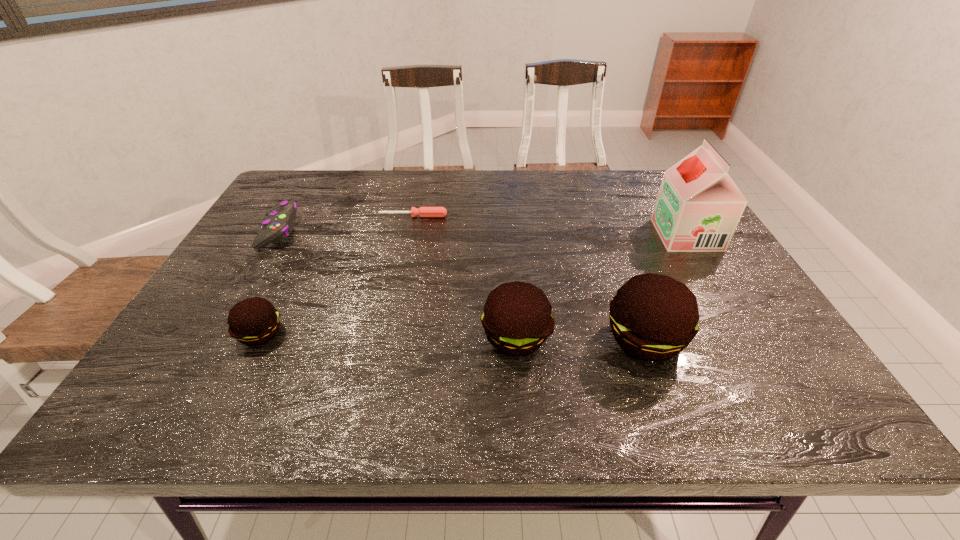
You are a GUI agent. You are given a task and a screenshot of the screen. Output one action in this format:
    pyautogui.click(x=<x>, y=<y>)
    Task: Click on the object positioned at the right edge
    Image resolution: width=960 pixels, height=540 pixels.
    Given the screenshot: What is the action you would take?
    pyautogui.click(x=698, y=208)

I want to click on object that is at the near left corner, so click(x=254, y=321).

Locate an element on the screen. Image resolution: width=960 pixels, height=540 pixels. vacant space at the far edge is located at coordinates (553, 176).

The width and height of the screenshot is (960, 540). In order to click on vacant space at the near edge of the desktop in this screenshot , I will do `click(614, 370)`.

Where is `free space at the left edge of the desktop`? free space at the left edge of the desktop is located at coordinates (207, 300).

In the image, there is a desktop. What are the coordinates of `free space at the right edge` in the screenshot? It's located at (673, 258).

You are a GUI agent. You are given a task and a screenshot of the screen. Output one action in this format:
    pyautogui.click(x=<x>, y=<y>)
    Task: Click on the free region at the far left corner of the desktop
    The image size is (960, 540).
    Given the screenshot: What is the action you would take?
    pyautogui.click(x=299, y=179)

At what (x,y) coordinates should I click in order to perform the action: click on free space at the far right corner. Please return your answer as a coordinate pair (x, y). The width and height of the screenshot is (960, 540). Looking at the image, I should click on (634, 185).

You are a GUI agent. You are given a task and a screenshot of the screen. Output one action in this format:
    pyautogui.click(x=<x>, y=<y>)
    Task: Click on the empty location between the fourth tallest object and the soya milk
    This screenshot has height=540, width=960.
    Given the screenshot: What is the action you would take?
    pyautogui.click(x=473, y=284)

Find the location of `free space that is in between the fifth tallest object and the second object from right to left`. free space that is in between the fifth tallest object and the second object from right to left is located at coordinates (462, 285).